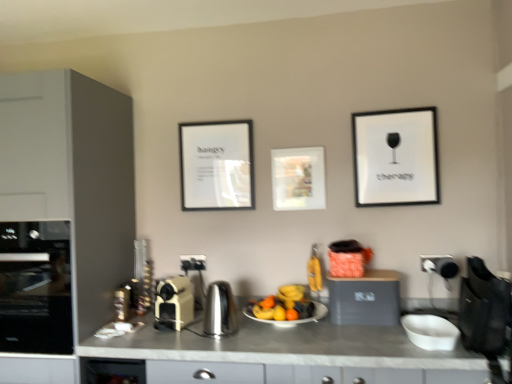
Question: From their relative heights in the image, would you say matte glass picture frame at center, the second picture frame in the front-to-back sequence, is taller or shorter than black glass oven at left?

Choices:
 (A) short
 (B) tall

Answer: (A)

Question: Is point (318, 190) positioned closer to the camera than point (7, 244)?

Choices:
 (A) farther
 (B) closer

Answer: (A)

Question: Which of these objects is positioned farthest from the matte glass picture frame at center, positioned as the 2th picture frame in right-to-left order?

Choices:
 (A) black glass oven at left
 (B) matte gray toaster at center, which is counted as the 1th cabinetry, starting from the bottom
 (C) white glossy plate at center
 (D) matte black picture frame at center, which is counted as the first picture frame, starting from the left
 (E) white matte bowl at lower right

Answer: (A)

Question: Which object is the farthest from the white glossy plate at center?

Choices:
 (A) matte black picture frame at center, placed as the 3th picture frame when sorted from front to back
 (B) matte black toaster at center, positioned as the 2th electric outlet in front-to-back order
 (C) matte gray toaster at center, placed as the 2th cabinetry when sorted from top to bottom
 (D) black matte picture frame at upper right, which is the first picture frame in front-to-back order
 (E) black glass oven at left

Answer: (E)